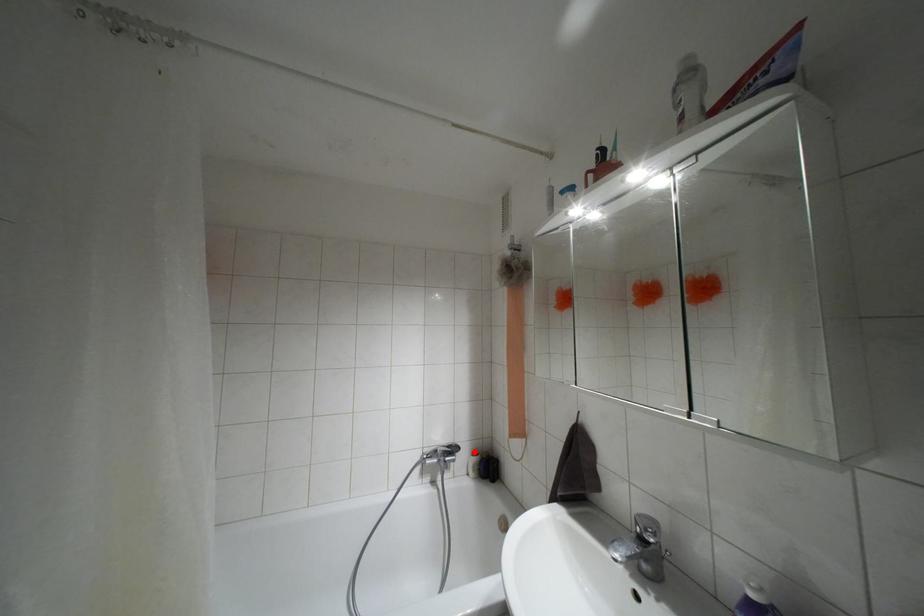
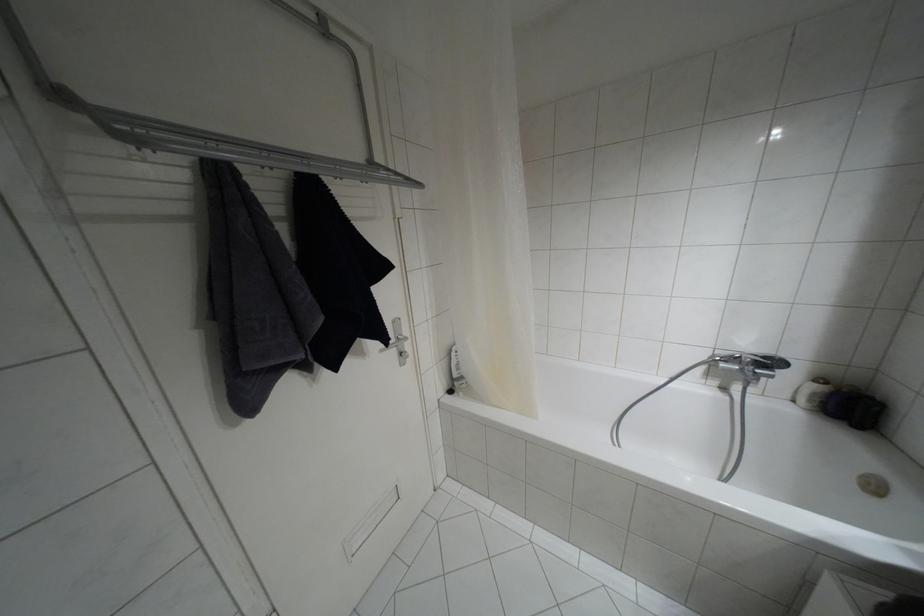
Question: I am providing you with two images of the same scene from different viewpoints. Given a red point in image1, look at the same physical point in image2. Is it:

Choices:
 (A) Closer to the viewpoint
 (B) Farther from the viewpoint

Answer: (A)